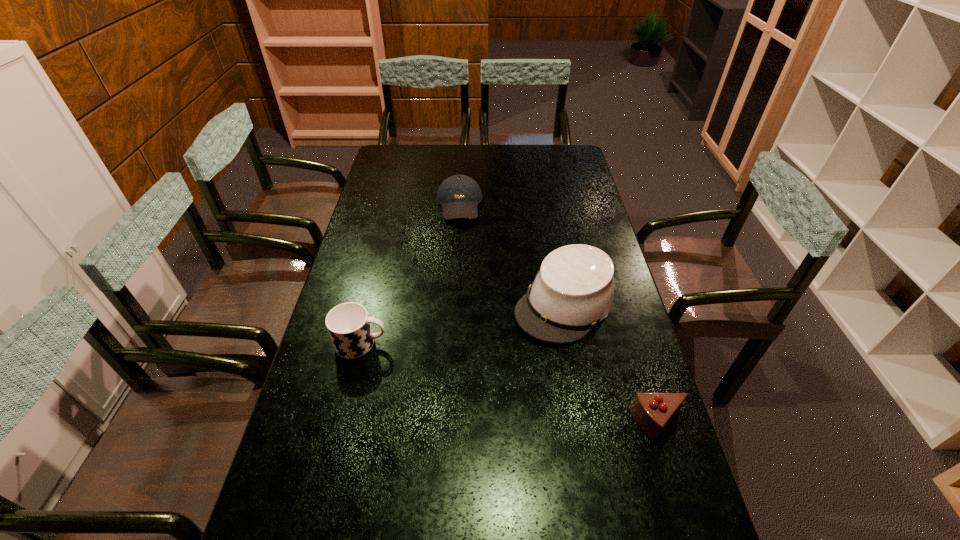
The width and height of the screenshot is (960, 540). What are the coordinates of `cup` in the screenshot? It's located at (348, 324).

Where is `the nearest object`? This screenshot has height=540, width=960. the nearest object is located at coordinates (652, 412).

Locate an element on the screen. hat is located at coordinates [x=573, y=291].

The width and height of the screenshot is (960, 540). Identify the location of baseball cap. (459, 195).

You are a GUI agent. You are given a task and a screenshot of the screen. Output one action in this format:
    pyautogui.click(x=<x>, y=<y>)
    Task: Click on the farthest object
    The image size is (960, 540).
    Given the screenshot: What is the action you would take?
    pyautogui.click(x=459, y=195)

Image resolution: width=960 pixels, height=540 pixels. I want to click on free space located on the side of the leftmost object with the handle, so click(x=518, y=343).

What are the coordinates of `vacant space located 0.120m on the left of the nearest object` in the screenshot? It's located at (586, 424).

Identify the location of free space located on the front-facing side of the hat. The height and width of the screenshot is (540, 960). (509, 362).

What are the coordinates of `vacant area located 0.300m on the front-facing side of the hat` in the screenshot? It's located at (466, 406).

Locate an element on the screen. The width and height of the screenshot is (960, 540). free space located 0.130m on the front-facing side of the hat is located at coordinates (507, 364).